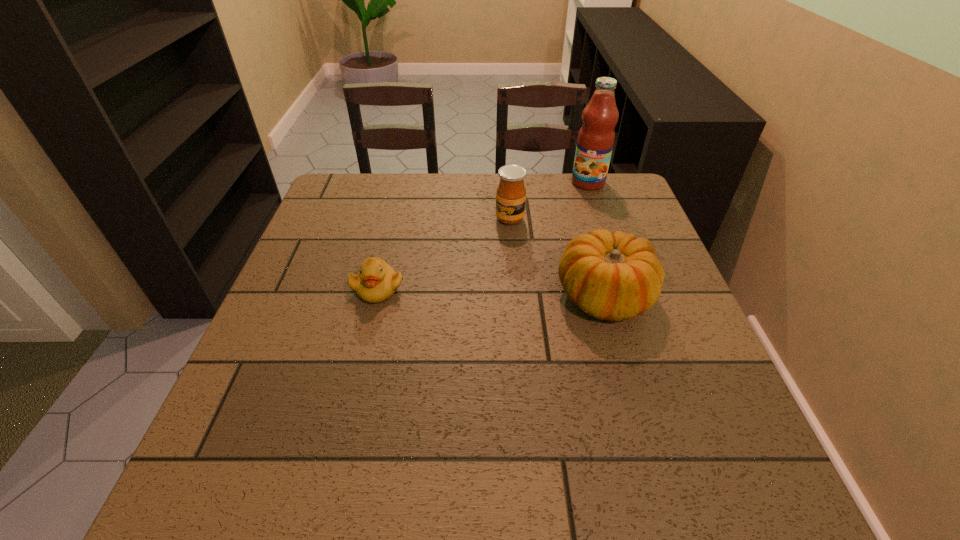
Locate an element on the screen. The image size is (960, 540). free spot on the desktop that is between the shortest object and the gourd and is positioned on the front label of the fruit juice is located at coordinates (516, 294).

Where is `vacant space on the desktop that is between the duckling and the gourd and is positioned on the front-facing side of the honey`? vacant space on the desktop that is between the duckling and the gourd and is positioned on the front-facing side of the honey is located at coordinates (473, 292).